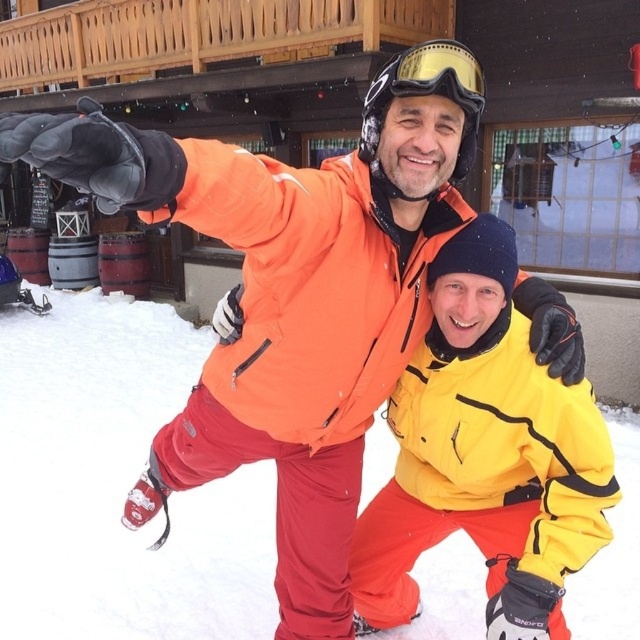
Question: Estimate the real-world distances between objects in this image. Which object is farther from the white powder snow at center?

Choices:
 (A) yellow matte jacket at center
 (B) gold reflective goggles at upper center

Answer: (B)

Question: Does yellow matte jacket at center lie in front of gold reflective goggles at upper center?

Choices:
 (A) yes
 (B) no

Answer: (B)

Question: Which point is closer to the camera?

Choices:
 (A) (428, 56)
 (B) (115, 378)
 (C) (520, 339)

Answer: (A)

Question: Is white powder snow at center wider than yellow matte jacket at center?

Choices:
 (A) yes
 (B) no

Answer: (B)

Question: Which point is closer to the camera?

Choices:
 (A) (435, 92)
 (B) (74, 442)

Answer: (A)

Question: Where is white powder snow at center located in relation to gold reflective goggles at upper center in the image?

Choices:
 (A) left
 (B) right

Answer: (B)